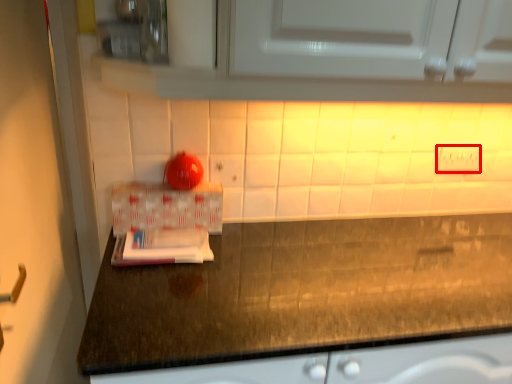
Question: From the image, what is the correct spatial relationship of electric outlet (annotated by the red box) in relation to box?

Choices:
 (A) left
 (B) right

Answer: (B)